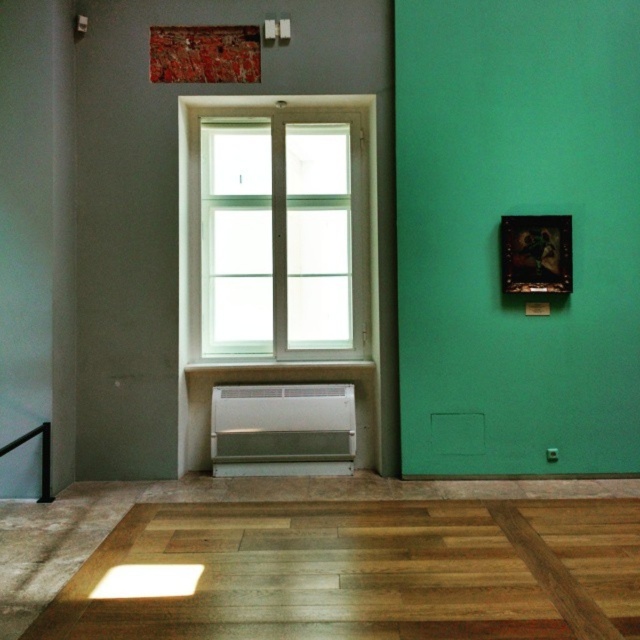
Which is more to the left, light brown wood flooring at center or white glass window at center?

From the viewer's perspective, white glass window at center appears more on the left side.

Which is in front, point (147, 595) or point (221, 122)?

Point (147, 595) is more forward.

Locate an element on the screen. The width and height of the screenshot is (640, 640). light brown wood flooring at center is located at coordinates (358, 572).

Who is taller, light brown wood flooring at center or white plastic radiator at center?

Standing taller between the two is white plastic radiator at center.

Is light brown wood flooring at center bigger than white plastic radiator at center?

Yes.

What do you see at coordinates (358, 572) in the screenshot? I see `light brown wood flooring at center` at bounding box center [358, 572].

At what (x,y) coordinates should I click in order to perform the action: click on light brown wood flooring at center. Please return your answer as a coordinate pair (x, y). Image resolution: width=640 pixels, height=640 pixels. Looking at the image, I should click on (358, 572).

Does point (346, 387) come farther from viewer compared to point (42, 460)?

Yes, it is.

Does white plastic radiator at center lie in front of black metal balustrade at lower left?

No, white plastic radiator at center is behind black metal balustrade at lower left.

Where is `white plastic radiator at center`? The height and width of the screenshot is (640, 640). white plastic radiator at center is located at coordinates (282, 429).